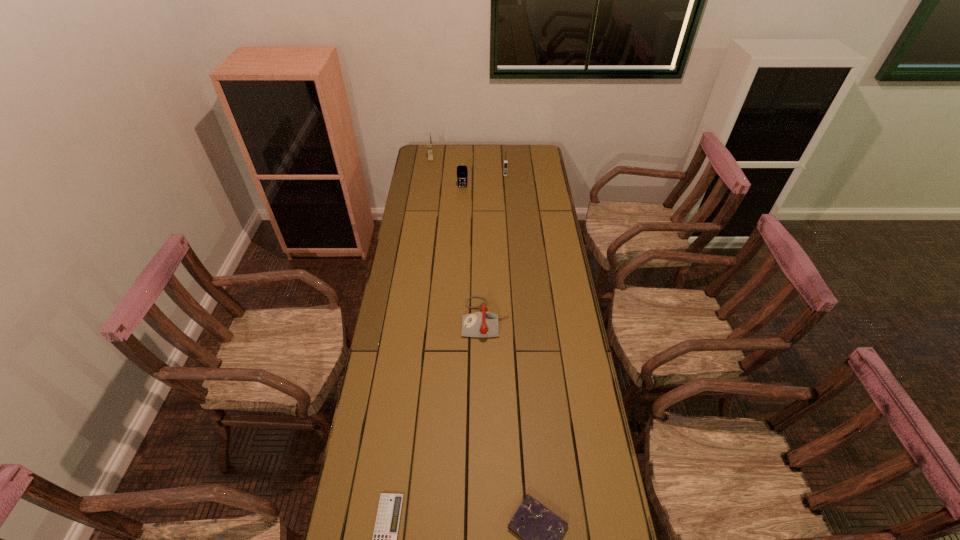
Where is `vacant position located on the screen of the second cellular telephone from right to left`? The image size is (960, 540). vacant position located on the screen of the second cellular telephone from right to left is located at coordinates (461, 221).

Where is `blank space located on the dial of the third nearest object`? The height and width of the screenshot is (540, 960). blank space located on the dial of the third nearest object is located at coordinates (413, 318).

Locate an element on the screen. The image size is (960, 540). blank area located on the dial of the third nearest object is located at coordinates (400, 318).

Identify the location of vacant space located on the dial of the third nearest object. (449, 318).

You are a GUI agent. You are given a task and a screenshot of the screen. Output one action in this format:
    pyautogui.click(x=<x>, y=<y>)
    Task: Click on the object located at the far edge
    This screenshot has height=540, width=960.
    Given the screenshot: What is the action you would take?
    pyautogui.click(x=429, y=144)

The height and width of the screenshot is (540, 960). What are the coordinates of `object at the left edge` in the screenshot? It's located at (429, 144).

I want to click on object present at the far left corner, so click(x=429, y=144).

I want to click on free region at the left edge of the desktop, so click(414, 302).

You are a GUI agent. You are given a task and a screenshot of the screen. Output one action in this format:
    pyautogui.click(x=<x>, y=<y>)
    Task: Click on the blank space at the right edge of the desktop
    The width and height of the screenshot is (960, 540).
    Given the screenshot: What is the action you would take?
    pyautogui.click(x=554, y=280)

Locate an element on the screen. The height and width of the screenshot is (540, 960). vacant space at the far left corner of the desktop is located at coordinates (419, 147).